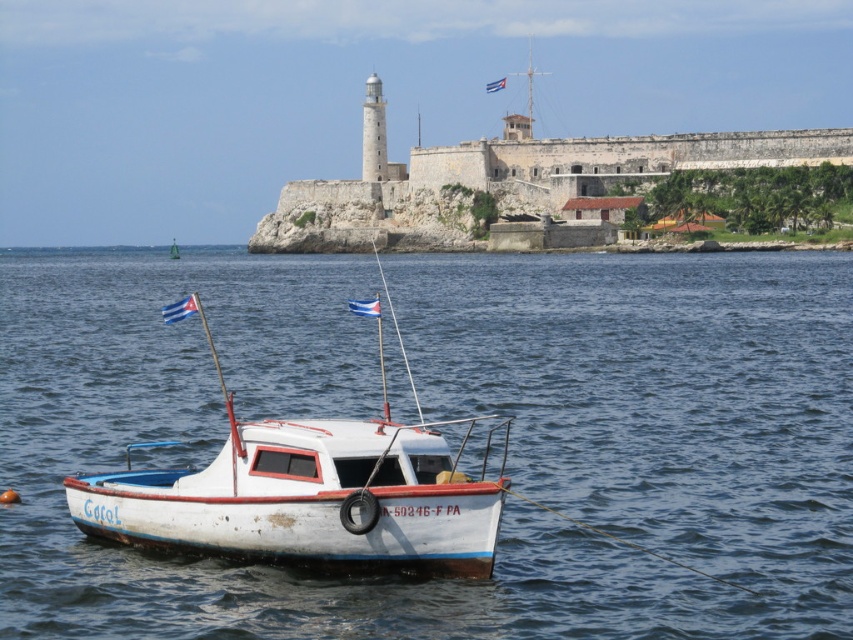
Question: Where is white water at boat front located in relation to white matte boat at center in the image?

Choices:
 (A) right
 (B) left

Answer: (A)

Question: Is the position of white water at boat front less distant than that of white matte boat at center?

Choices:
 (A) no
 (B) yes

Answer: (B)

Question: Which of the following is the closest to the observer?

Choices:
 (A) white water at boat front
 (B) white matte boat at center

Answer: (A)

Question: Which of the following is the farthest from the observer?

Choices:
 (A) (0, 276)
 (B) (297, 449)

Answer: (A)

Question: Can you confirm if white water at boat front is positioned below white matte boat at center?

Choices:
 (A) no
 (B) yes

Answer: (A)